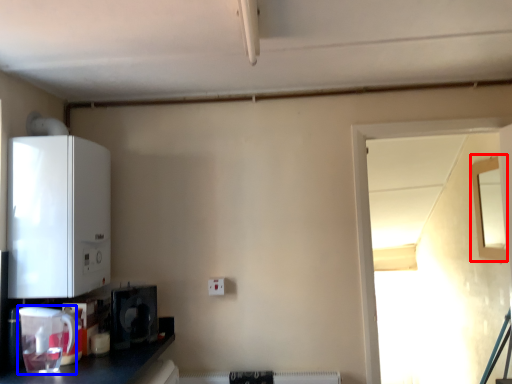
Question: Which point is further to the camera, window (highlighted by a red box) or appliance (highlighted by a blue box)?

Choices:
 (A) window
 (B) appliance

Answer: (A)